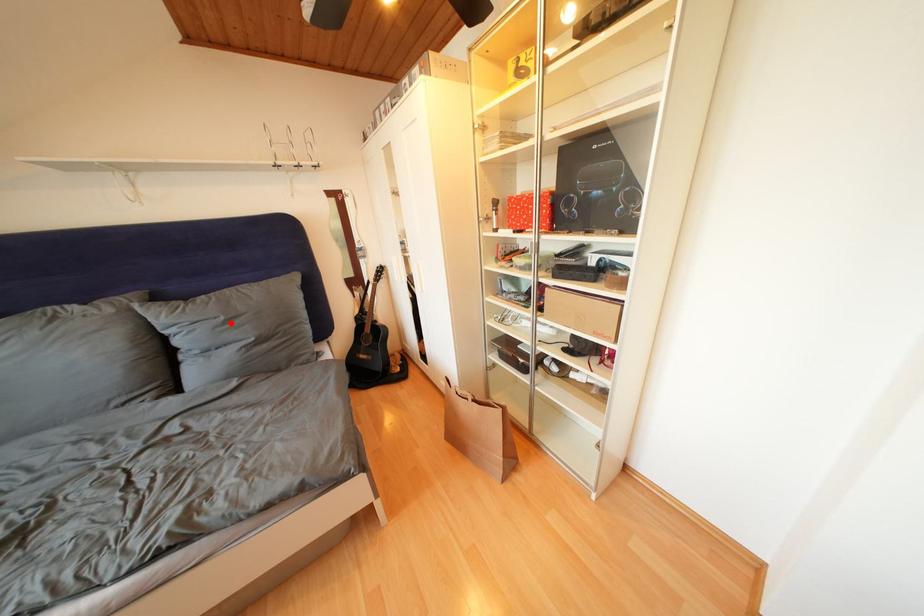
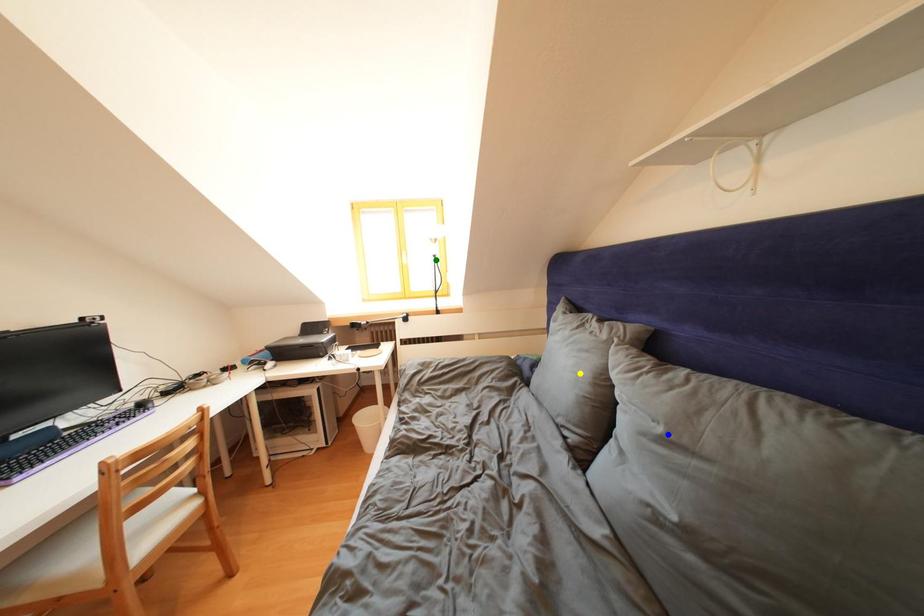
Question: I am providing you with two images of the same scene from different viewpoints. A red point is marked on the first image. You are given multiple points on the second image. Which point in image 2 is actually the same real-world point as the red point in image 1?

Choices:
 (A) yellow point
 (B) green point
 (C) blue point

Answer: (C)